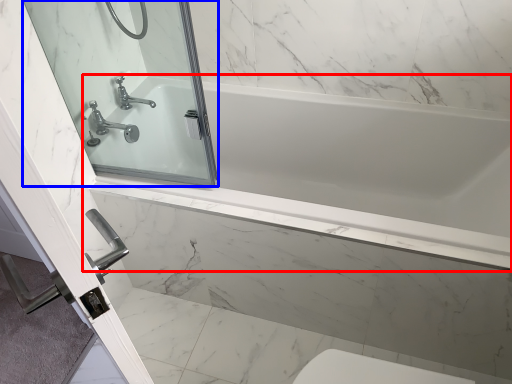
Question: Among these objects, which one is farthest to the camera, bathtub (highlighted by a red box) or mirror (highlighted by a blue box)?

Choices:
 (A) bathtub
 (B) mirror

Answer: (A)